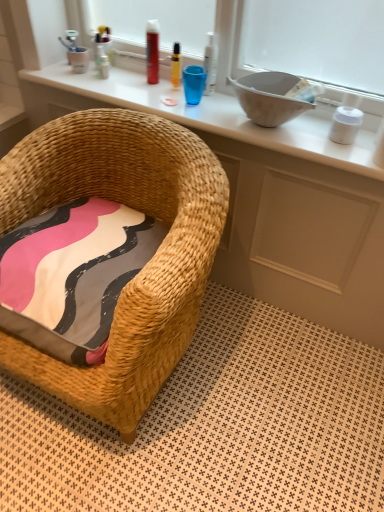
Identify the location of vacant space in between gray matte bowl at upper right and white matte container at upper right, marked as the 1th toiletry in a right-to-left arrangement. This screenshot has height=512, width=384. (320, 138).